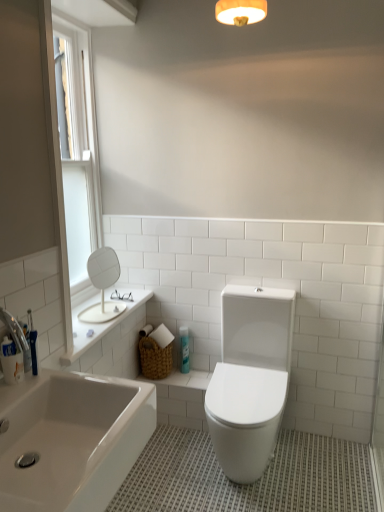
Question: Is white matte round mirror at upper left in contact with white glossy toilet at center?

Choices:
 (A) no
 (B) yes

Answer: (A)

Question: From the image's perspective, is white matte round mirror at upper left above white glossy toilet at center?

Choices:
 (A) no
 (B) yes

Answer: (B)

Question: Considering the relative positions of white matte round mirror at upper left and white glossy toilet at center in the image provided, is white matte round mirror at upper left behind white glossy toilet at center?

Choices:
 (A) no
 (B) yes

Answer: (B)

Question: Is white glossy toilet at center completely or partially inside white matte round mirror at upper left?

Choices:
 (A) yes
 (B) no

Answer: (B)

Question: Considering the relative positions of white matte round mirror at upper left and white glossy toilet at center in the image provided, is white matte round mirror at upper left to the left of white glossy toilet at center from the viewer's perspective?

Choices:
 (A) yes
 (B) no

Answer: (A)

Question: Is white glossy toilet at center bigger or smaller than white matte round mirror at upper left?

Choices:
 (A) small
 (B) big

Answer: (B)

Question: Is white glossy toilet at center inside the boundaries of white matte round mirror at upper left, or outside?

Choices:
 (A) inside
 (B) outside

Answer: (B)

Question: Is point (253, 450) positioned closer to the camera than point (105, 280)?

Choices:
 (A) farther
 (B) closer

Answer: (B)

Question: Based on their positions, is white glossy toilet at center located to the left or right of white matte round mirror at upper left?

Choices:
 (A) left
 (B) right

Answer: (B)

Question: From the image's perspective, is white glossy bathtub at lower left above or below blue glossy spray can at center?

Choices:
 (A) below
 (B) above

Answer: (A)

Question: Looking at the image, does white glossy bathtub at lower left seem bigger or smaller compared to blue glossy spray can at center?

Choices:
 (A) small
 (B) big

Answer: (B)

Question: Would you say white glossy bathtub at lower left is to the left or to the right of blue glossy spray can at center in the picture?

Choices:
 (A) right
 (B) left

Answer: (B)

Question: Is point (99, 465) closer or farther from the camera than point (183, 348)?

Choices:
 (A) farther
 (B) closer

Answer: (B)

Question: Choose the correct answer: Is white plastic window screen at upper left inside blue glossy spray can at center or outside it?

Choices:
 (A) inside
 (B) outside

Answer: (B)

Question: In terms of height, does white plastic window screen at upper left look taller or shorter compared to blue glossy spray can at center?

Choices:
 (A) tall
 (B) short

Answer: (A)